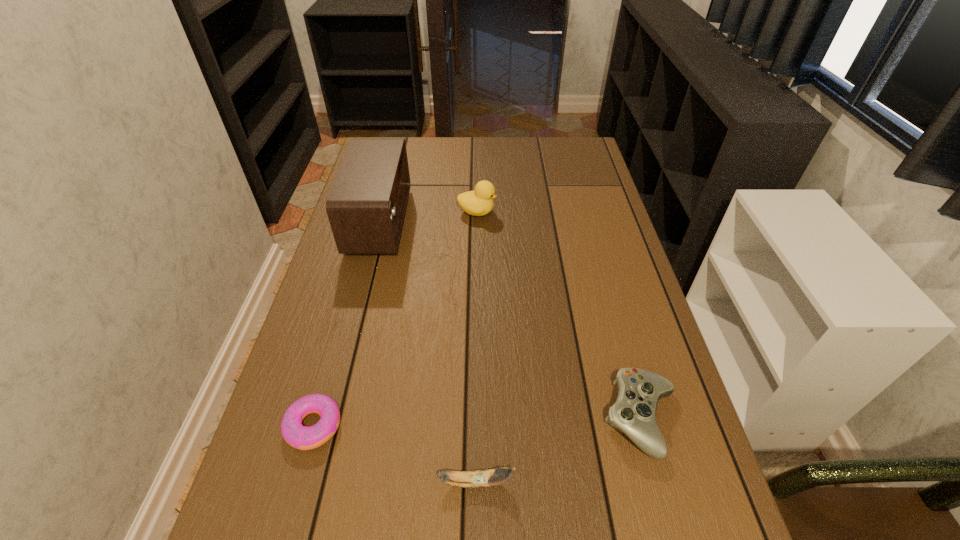
Where is `vacant space that satisfies the following two spatial constraints: 1. on the front side of the rightmost object; 2. on the peel of the nearest object`? vacant space that satisfies the following two spatial constraints: 1. on the front side of the rightmost object; 2. on the peel of the nearest object is located at coordinates pyautogui.click(x=659, y=482).

The width and height of the screenshot is (960, 540). Identify the location of vacant space that satisfies the following two spatial constraints: 1. on the back side of the doughnut; 2. on the right side of the control. (315, 419).

This screenshot has height=540, width=960. Find the location of `free location that satisfies the following two spatial constraints: 1. on the front-facing side of the duck; 2. on the right side of the rightmost object`. free location that satisfies the following two spatial constraints: 1. on the front-facing side of the duck; 2. on the right side of the rightmost object is located at coordinates (475, 419).

You are a GUI agent. You are given a task and a screenshot of the screen. Output one action in this format:
    pyautogui.click(x=<x>, y=<y>)
    Task: Click on the free spot that satisfies the following two spatial constraints: 1. on the front-facing side of the rightmost object; 2. on the left side of the second tallest object
    The height and width of the screenshot is (540, 960).
    Given the screenshot: What is the action you would take?
    pyautogui.click(x=475, y=419)